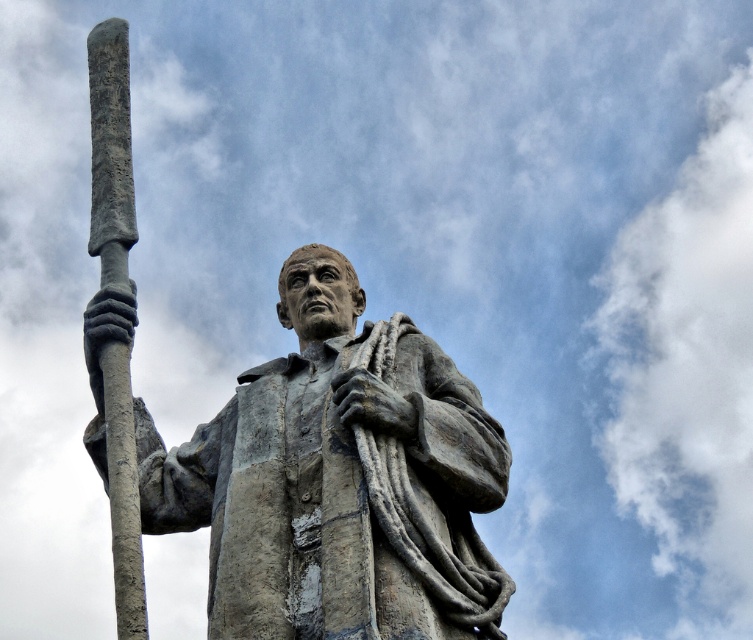
You are standing in front of the statue and want to place a small flower bouquet between the bronze statue at center and the gray stone spear at left. Based on their positions, which object should the bouquet be closer to?

The bronze statue at center is to the right of gray stone spear at left, so the bouquet should be placed closer to the gray stone spear at left to be between them.

You are a painter standing on a ladder to paint the bronze statue at center. The gray stone spear at left is blocking your view. Can you move the ladder to the right to paint the statue without moving the spear?

The bronze statue at center is positioned under the gray stone spear at left, so moving the ladder to the right would allow you to paint the statue without obstruction from the spear.

You are standing at point 0.5, 0.5 in the image coordinate system. Where is the bronze statue at center located relative to your position?

The bronze statue at center is located at point (337, 480) in the image coordinate system, which is to the right and slightly below your current position at (376, 320).